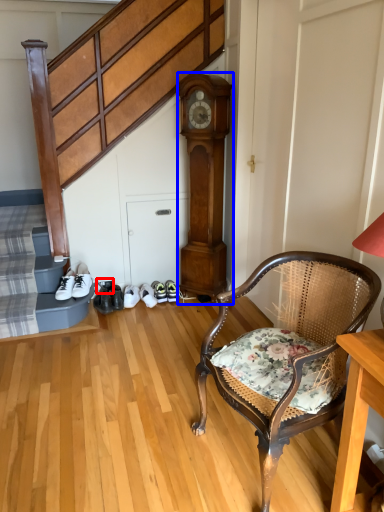
Question: Which of the following is the closest to the observer, shoe (highlighted by a red box) or clock (highlighted by a blue box)?

Choices:
 (A) shoe
 (B) clock

Answer: (B)